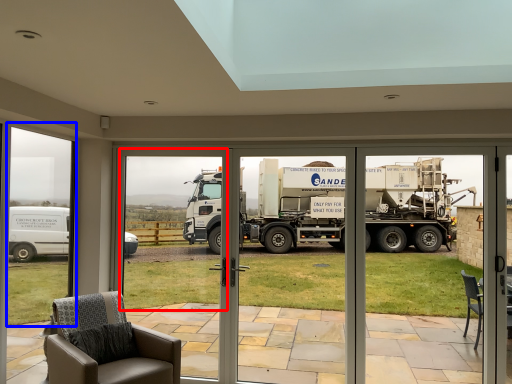
Question: Which of the following is the farthest to the observer, window screen (highlighted by a red box) or window frame (highlighted by a blue box)?

Choices:
 (A) window screen
 (B) window frame

Answer: (A)